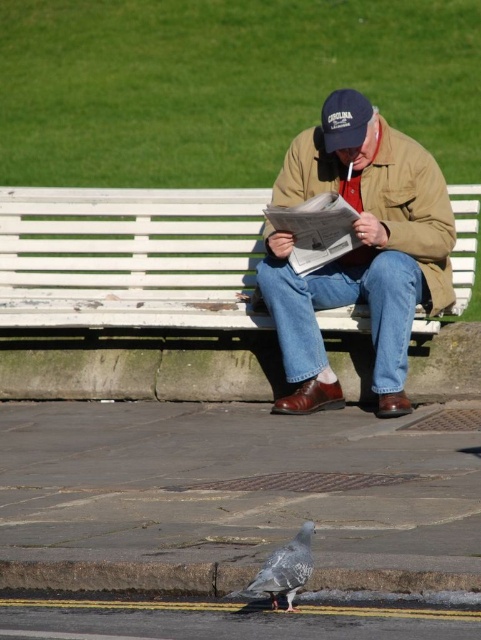
Question: Among these points, which one is farthest from the camera?

Choices:
 (A) (277, 557)
 (B) (394, 365)

Answer: (B)

Question: Which object is positioned closest to the white wooden bench at center?

Choices:
 (A) speckled gray pigeon at lower center
 (B) tan leather jacket at center

Answer: (B)

Question: Is white wooden bench at center closer to the viewer compared to dark blue fabric baseball cap at center?

Choices:
 (A) yes
 (B) no

Answer: (B)

Question: Which point is closer to the camera taking this photo?

Choices:
 (A) (283, 552)
 (B) (409, 256)
 (C) (354, 145)
 (D) (226, 234)

Answer: (A)

Question: From the image, what is the correct spatial relationship of white wooden bench at center in relation to tan leather jacket at center?

Choices:
 (A) below
 (B) above

Answer: (A)

Question: Is tan leather jacket at center above speckled gray pigeon at lower center?

Choices:
 (A) no
 (B) yes

Answer: (B)